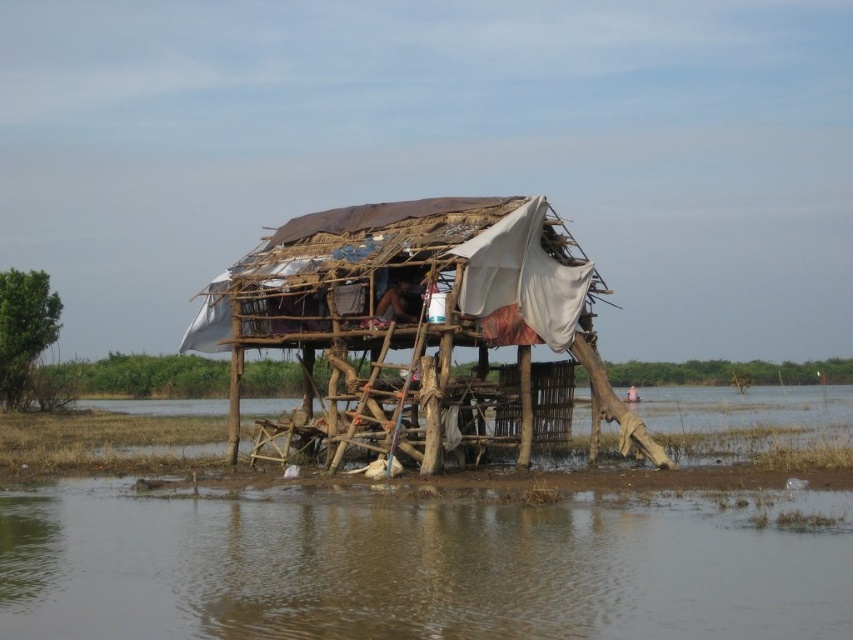
Question: Which point is farther from the camera taking this photo?

Choices:
 (A) (337, 209)
 (B) (798, 580)

Answer: (A)

Question: Where is brown muddy water at lower center located in relation to rusty wood shack at center in the image?

Choices:
 (A) below
 (B) above

Answer: (A)

Question: Which point appears farthest from the camera in this image?

Choices:
 (A) (366, 324)
 (B) (576, 541)

Answer: (A)

Question: Is brown muddy water at lower center to the left of rusty wood shack at center from the viewer's perspective?

Choices:
 (A) no
 (B) yes

Answer: (A)

Question: Does brown muddy water at lower center have a smaller size compared to rusty wood shack at center?

Choices:
 (A) yes
 (B) no

Answer: (A)

Question: Which point is farther from the camera taking this photo?

Choices:
 (A) click(x=438, y=426)
 (B) click(x=303, y=602)

Answer: (A)